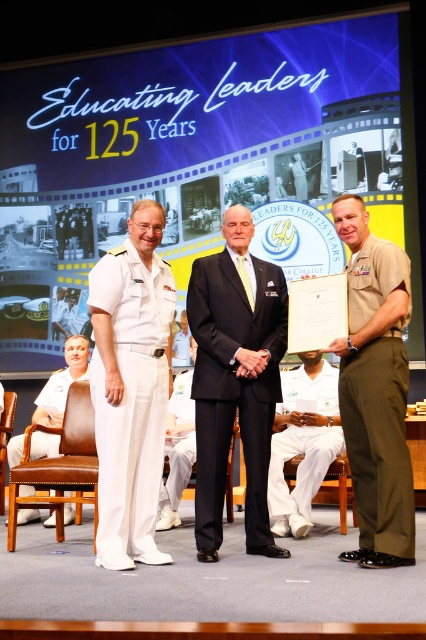
Is black suit at center taller than olive green fabric pants at right?

In fact, black suit at center may be shorter than olive green fabric pants at right.

Is black suit at center bigger than olive green fabric pants at right?

Correct, black suit at center is larger in size than olive green fabric pants at right.

Who is more forward, (x=224, y=342) or (x=368, y=432)?

Positioned in front is point (x=368, y=432).

You are a GUI agent. You are given a task and a screenshot of the screen. Output one action in this format:
    pyautogui.click(x=<x>, y=<y>)
    Task: Click on the black suit at center
    
    Given the screenshot: What is the action you would take?
    pyautogui.click(x=233, y=387)

Is white cotton pants at left shorter than olive green fabric pants at right?

Yes.

Between white cotton pants at left and olive green fabric pants at right, which one has more height?

With more height is olive green fabric pants at right.

Between point (143, 538) and point (351, 444), which one is positioned behind?

Point (143, 538)

Where is `white cotton pants at left`? The image size is (426, 640). white cotton pants at left is located at coordinates (131, 396).

Does white cotton uniform at lower center have a greater width compared to white uniform at left?

In fact, white cotton uniform at lower center might be narrower than white uniform at left.

Between white cotton uniform at lower center and white uniform at left, which one has more height?

white cotton uniform at lower center is taller.

Where is `white cotton uniform at lower center`? The height and width of the screenshot is (640, 426). white cotton uniform at lower center is located at coordinates (304, 442).

The width and height of the screenshot is (426, 640). I want to click on white cotton uniform at lower center, so click(304, 442).